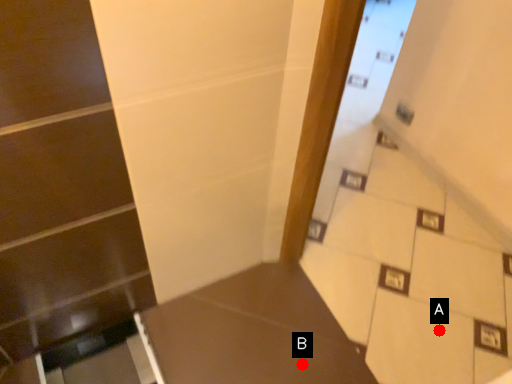
Question: Two points are circled on the image, labeled by A and B beside each circle. Among these points, which one is farthest from the camera?

Choices:
 (A) A is further
 (B) B is further

Answer: (A)